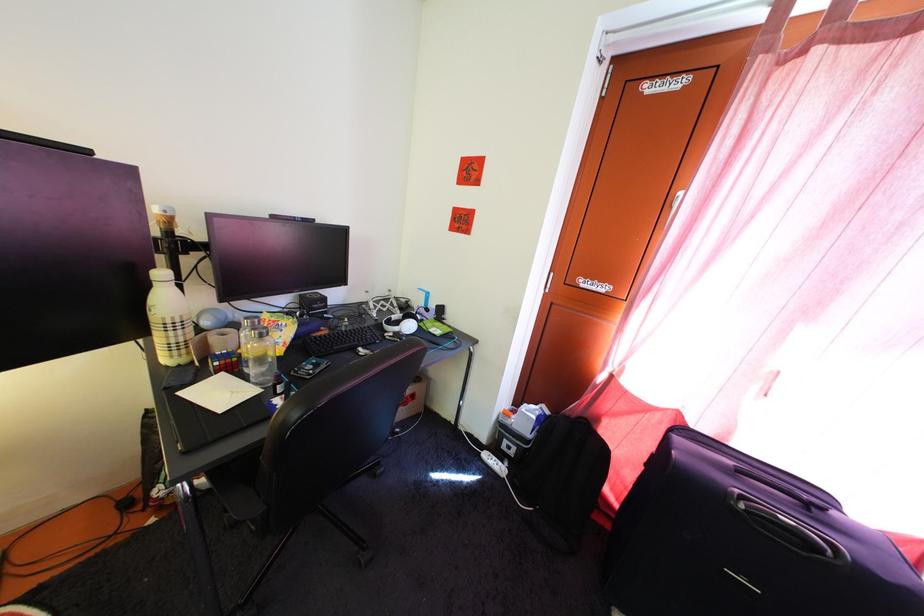
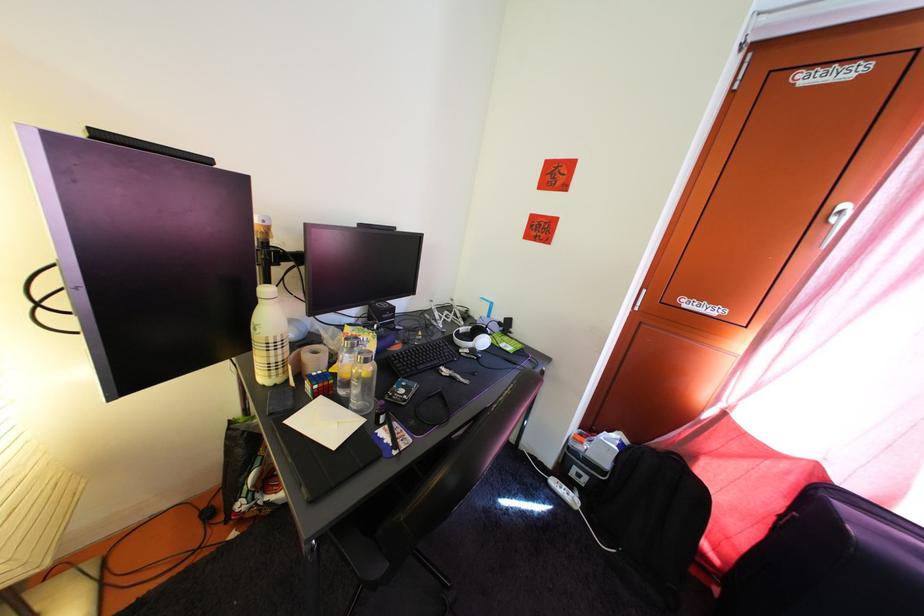
Question: What movement of the cameraman would produce the second image?

Choices:
 (A) Left
 (B) Right
 (C) Forward
 (D) Backward

Answer: (A)